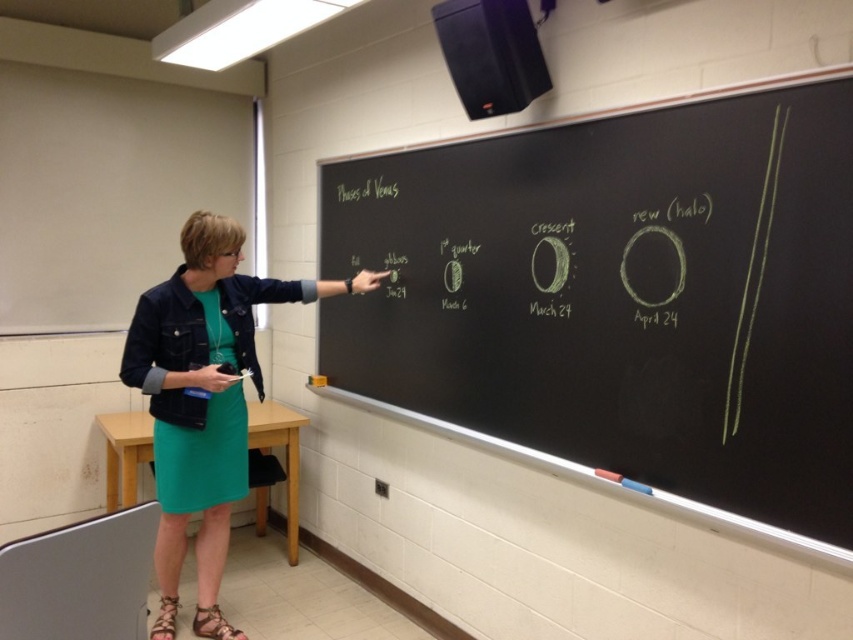
Question: Is green chalkboard at upper center thinner than green fabric dress at center?

Choices:
 (A) yes
 (B) no

Answer: (B)

Question: Does green chalkboard at upper center have a lesser width compared to green fabric dress at center?

Choices:
 (A) yes
 (B) no

Answer: (B)

Question: Which point is farther to the camera?

Choices:
 (A) green fabric dress at center
 (B) green chalkboard at upper center

Answer: (A)

Question: Does green chalkboard at upper center have a smaller size compared to green fabric dress at center?

Choices:
 (A) no
 (B) yes

Answer: (A)

Question: Which object appears closest to the camera in this image?

Choices:
 (A) green fabric dress at center
 (B) green chalkboard at upper center

Answer: (B)